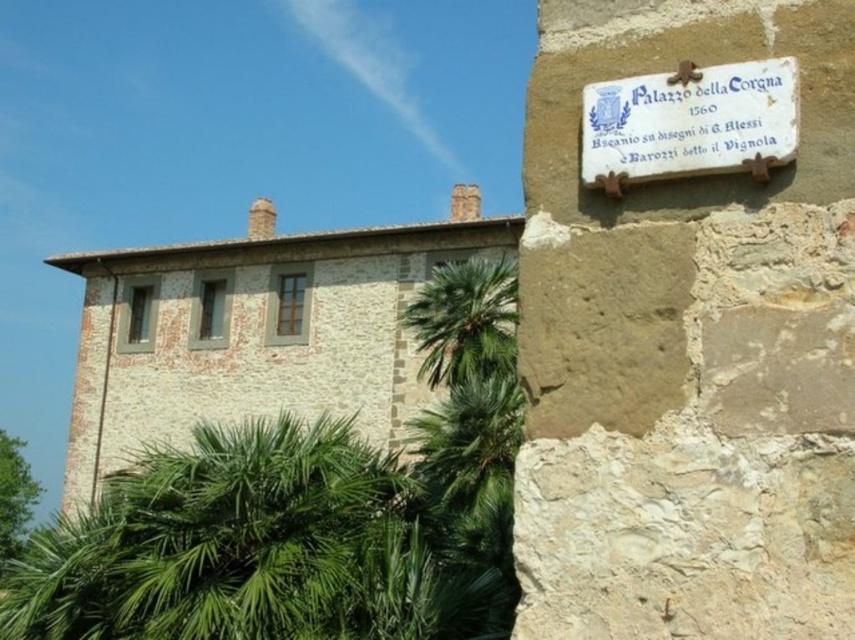
Is point (727, 160) positioned behind point (504, 305)?

No.

Based on the photo, is white stone plaque at upper right bigger than green leafy palm at center?

Actually, white stone plaque at upper right might be smaller than green leafy palm at center.

What do you see at coordinates (688, 124) in the screenshot? The width and height of the screenshot is (855, 640). I see `white stone plaque at upper right` at bounding box center [688, 124].

The height and width of the screenshot is (640, 855). What are the coordinates of `white stone plaque at upper right` in the screenshot? It's located at (688, 124).